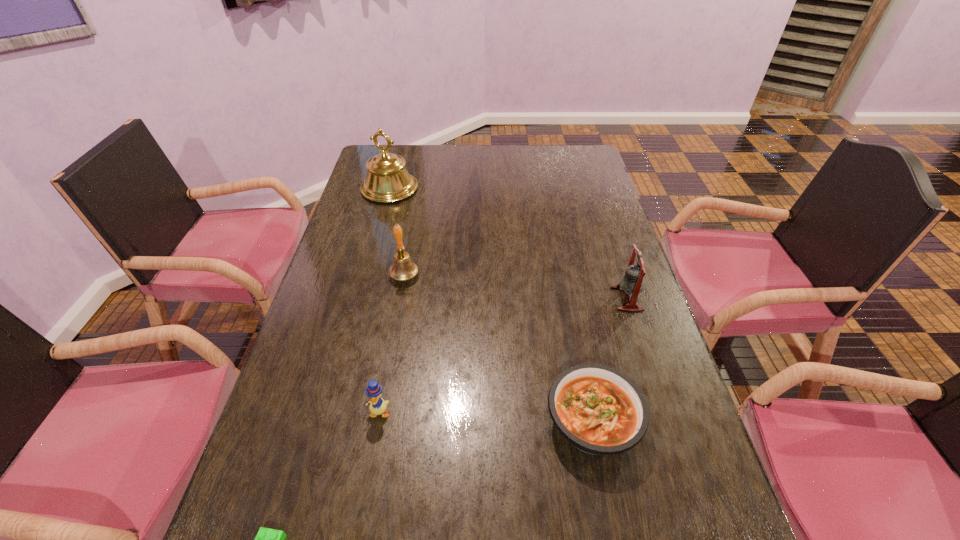
Identify the location of object positioned at the far edge. This screenshot has width=960, height=540. (387, 180).

Where is `object located in the left edge section of the desktop`? The height and width of the screenshot is (540, 960). object located in the left edge section of the desktop is located at coordinates (387, 180).

Find the location of a particular element. The height and width of the screenshot is (540, 960). bell located in the right edge section of the desktop is located at coordinates (632, 283).

Find the location of a particular element. stew at the right edge is located at coordinates (599, 410).

At what (x,y) coordinates should I click in order to perform the action: click on object positioned at the far left corner. Please return your answer as a coordinate pair (x, y). Image resolution: width=960 pixels, height=540 pixels. Looking at the image, I should click on (387, 180).

What are the coordinates of `vacant space at the far edge of the desktop` in the screenshot? It's located at (519, 157).

This screenshot has width=960, height=540. In the image, there is a desktop. In order to click on vacant space at the left edge in this screenshot , I will do `click(312, 313)`.

The height and width of the screenshot is (540, 960). I want to click on vacant space at the right edge of the desktop, so click(x=685, y=415).

Where is `vacant space in between the duckling and the tallest object`? The height and width of the screenshot is (540, 960). vacant space in between the duckling and the tallest object is located at coordinates (384, 300).

Locate an element on the screen. The width and height of the screenshot is (960, 540). vacant area that lies between the tallest object and the fourth tallest object is located at coordinates (384, 300).